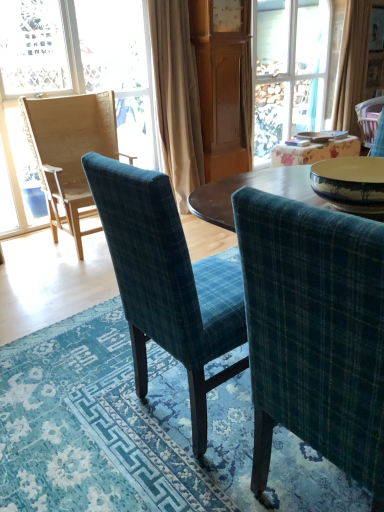
What do you see at coordinates (167, 282) in the screenshot? I see `teal plaid chair at center, the 2th chair positioned from the left` at bounding box center [167, 282].

In the scene shown: What is the approximate width of teal plaid chair at center, the third chair when ordered from right to left?

It is 22.24 inches.

What do you see at coordinates (69, 151) in the screenshot?
I see `woven wood chair at left, the first chair from the left` at bounding box center [69, 151].

What do you see at coordinates (314, 332) in the screenshot? The width and height of the screenshot is (384, 512). I see `teal plaid chair at center, marked as the third chair in a left-to-right arrangement` at bounding box center [314, 332].

Locate an element on the screen. The height and width of the screenshot is (512, 384). wooden table at center is located at coordinates (314, 151).

You are a GUI agent. You are given a task and a screenshot of the screen. Output one action in this format:
    pyautogui.click(x=<x>, y=<y>)
    Task: Click on the teal plaid chair at center, acting as the third chair starting from the back
    
    Given the screenshot: What is the action you would take?
    click(x=167, y=282)

Between pink fabric chair at upper right, the 1th chair from the back, and teal plaid chair at center, the third chair when ordered from right to left, which one has larger width?

teal plaid chair at center, the third chair when ordered from right to left, is wider.

Does pink fabric chair at upper right, which ranks as the 1th chair in right-to-left order, come behind teal plaid chair at center, the third chair when ordered from right to left?

Yes, pink fabric chair at upper right, which ranks as the 1th chair in right-to-left order, is further from the viewer.

Is point (357, 117) less distant than point (122, 264)?

No.

Is pink fabric chair at upper right, which ranks as the 1th chair in right-to-left order, facing away from teal plaid chair at center, which is counted as the second chair, starting from the front?

pink fabric chair at upper right, which ranks as the 1th chair in right-to-left order, does not have its back to teal plaid chair at center, which is counted as the second chair, starting from the front.

Can you confirm if blue textured rug at center is positioned to the right of wooden chair at left?

Indeed, blue textured rug at center is positioned on the right side of wooden chair at left.

Considering the points (130, 505) and (76, 85), which point is behind, point (130, 505) or point (76, 85)?

The point (76, 85) is more distant.

From their relative heights in the image, would you say blue textured rug at center is taller or shorter than wooden chair at left?

Considering their sizes, blue textured rug at center has less height than wooden chair at left.

Is blue textured rug at center bigger or smaller than wooden chair at left?

Clearly, blue textured rug at center is smaller in size than wooden chair at left.

From a real-world perspective, is wooden chair at left positioned over beige fabric curtain at center, the 1th curtain positioned from the left, based on gravity?

Yes, from a real-world perspective, wooden chair at left is over beige fabric curtain at center, the 1th curtain positioned from the left

Which of these two, wooden chair at left or beige fabric curtain at center, which is the 2th curtain in back-to-front order, is bigger?

wooden chair at left.

What's the angular difference between wooden chair at left and beige fabric curtain at center, which is the 2th curtain in back-to-front order,'s facing directions?

The facing directions of wooden chair at left and beige fabric curtain at center, which is the 2th curtain in back-to-front order, are 0.8 degrees apart.

Who is taller, wooden chair at left or beige fabric curtain at center, the 1th curtain positioned from the left?

wooden chair at left is taller.

Which of these two, pink fabric chair at upper right, the 1th chair from the back, or blue textured rug at center, is thinner?

pink fabric chair at upper right, the 1th chair from the back, is thinner.

Is pink fabric chair at upper right, arranged as the 4th chair when viewed from the left, aimed at blue textured rug at center?

No, pink fabric chair at upper right, arranged as the 4th chair when viewed from the left, is not turned towards blue textured rug at center.

Looking at this image, can you confirm if pink fabric chair at upper right, the fourth chair in the front-to-back sequence, is smaller than blue textured rug at center?

Yes.

Between pink fabric chair at upper right, which ranks as the 1th chair in right-to-left order, and blue textured rug at center, which one has less height?

Standing shorter between the two is blue textured rug at center.

Considering the relative sizes of gold textured curtain at upper right, which is counted as the second curtain, starting from the left, and woven wood chair at left, the first chair from the left, in the image provided, is gold textured curtain at upper right, which is counted as the second curtain, starting from the left, taller than woven wood chair at left, the first chair from the left,?

Correct, gold textured curtain at upper right, which is counted as the second curtain, starting from the left, is much taller as woven wood chair at left, the first chair from the left.

Which object is closer to the camera taking this photo, gold textured curtain at upper right, marked as the first curtain in a back-to-front arrangement, or woven wood chair at left, the first chair from the left?

woven wood chair at left, the first chair from the left, is closer to the camera.

From the picture: From the image's perspective, between gold textured curtain at upper right, marked as the first curtain in a back-to-front arrangement, and woven wood chair at left, the first chair from the left, which one is located above?

gold textured curtain at upper right, marked as the first curtain in a back-to-front arrangement, from the image's perspective.

Considering the sizes of objects gold textured curtain at upper right, positioned as the first curtain in right-to-left order, and woven wood chair at left, positioned as the 4th chair in right-to-left order, in the image provided, who is thinner, gold textured curtain at upper right, positioned as the first curtain in right-to-left order, or woven wood chair at left, positioned as the 4th chair in right-to-left order,?

gold textured curtain at upper right, positioned as the first curtain in right-to-left order.

Is beige fabric curtain at center, positioned as the 1th curtain in front-to-back order, situated inside teal plaid chair at center, marked as the third chair in a left-to-right arrangement, or outside?

beige fabric curtain at center, positioned as the 1th curtain in front-to-back order, exists outside the volume of teal plaid chair at center, marked as the third chair in a left-to-right arrangement.

Is the position of beige fabric curtain at center, positioned as the 1th curtain in front-to-back order, less distant than that of teal plaid chair at center, which appears as the first chair when viewed from the front?

No, it is behind teal plaid chair at center, which appears as the first chair when viewed from the front.

Who is smaller, beige fabric curtain at center, which is the 2th curtain in back-to-front order, or teal plaid chair at center, marked as the third chair in a left-to-right arrangement?

Smaller between the two is teal plaid chair at center, marked as the third chair in a left-to-right arrangement.

The width and height of the screenshot is (384, 512). What are the coordinates of `curtain below the gold textured curtain at upper right, the second curtain viewed from the front (from the image's perspective)` in the screenshot? It's located at (177, 97).

From a real-world perspective, which is physically below, gold textured curtain at upper right, which is counted as the second curtain, starting from the left, or beige fabric curtain at center, the second curtain viewed from the right?

beige fabric curtain at center, the second curtain viewed from the right, from a real-world perspective.

From the image's perspective, between gold textured curtain at upper right, which is counted as the second curtain, starting from the left, and beige fabric curtain at center, positioned as the 1th curtain in front-to-back order, who is located below?

beige fabric curtain at center, positioned as the 1th curtain in front-to-back order, is shown below in the image.

Is gold textured curtain at upper right, positioned as the first curtain in right-to-left order, aimed at beige fabric curtain at center, positioned as the 1th curtain in front-to-back order?

No, gold textured curtain at upper right, positioned as the first curtain in right-to-left order, is not oriented towards beige fabric curtain at center, positioned as the 1th curtain in front-to-back order.

Find the location of a particular element. The image size is (384, 512). the 2nd chair behind the teal plaid chair at center, the 2th chair positioned from the left is located at coordinates (369, 118).

Image resolution: width=384 pixels, height=512 pixels. Identify the location of window positioned vertically above the blue textured rug at center (from a real-world perspective). (77, 72).

Considering their positions, is wooden table at center positioned closer to transparent glass door at upper center than pink fabric chair at upper right, the 1th chair from the back?

Among the two, wooden table at center is located nearer to transparent glass door at upper center.

Which object lies nearer to the anchor point gold textured curtain at upper right, the second curtain viewed from the front, wooden table at center or pink fabric chair at upper right, the 1th chair from the back?

pink fabric chair at upper right, the 1th chair from the back, is closer to gold textured curtain at upper right, the second curtain viewed from the front.

Estimate the real-world distances between objects in this image. Which object is closer to teal plaid chair at center, acting as the third chair starting from the back, pink fabric chair at upper right, the 1th chair from the back, or wooden table at center?

wooden table at center.

Estimate the real-world distances between objects in this image. Which object is closer to transparent glass door at upper center, teal plaid chair at center, acting as the third chair starting from the back, or gold textured curtain at upper right, which is counted as the second curtain, starting from the left?

gold textured curtain at upper right, which is counted as the second curtain, starting from the left, is closer to transparent glass door at upper center.

Looking at the image, which one is located further to teal plaid chair at center, the third chair when ordered from right to left, wooden table at center or teal plaid chair at center, which is the 4th chair from back to front?

wooden table at center is further to teal plaid chair at center, the third chair when ordered from right to left.

Which object lies nearer to the anchor point pink fabric chair at upper right, the 1th chair from the back, wooden chair at left or blue textured rug at center?

Among the two, wooden chair at left is located nearer to pink fabric chair at upper right, the 1th chair from the back.

Looking at the image, which one is located further to wooden table at center, teal plaid chair at center, marked as the third chair in a left-to-right arrangement, or transparent glass door at upper center?

Among the two, teal plaid chair at center, marked as the third chair in a left-to-right arrangement, is located further to wooden table at center.

Looking at the image, which one is located closer to woven wood chair at left, arranged as the 3th chair when viewed from the front, beige fabric curtain at center, the second curtain viewed from the right, or blue textured rug at center?

beige fabric curtain at center, the second curtain viewed from the right, is closer to woven wood chair at left, arranged as the 3th chair when viewed from the front.

Locate an element on the screen. window located between teal plaid chair at center, acting as the third chair starting from the back, and beige fabric curtain at center, which is the 2th curtain in back-to-front order, in the depth direction is located at coordinates (77, 72).

Find the location of a particular element. The height and width of the screenshot is (512, 384). curtain between teal plaid chair at center, marked as the third chair in a left-to-right arrangement, and transparent glass door at upper center, along the z-axis is located at coordinates (177, 97).

Locate an element on the screen. The image size is (384, 512). mat positioned between teal plaid chair at center, marked as the third chair in a left-to-right arrangement, and gold textured curtain at upper right, positioned as the first curtain in right-to-left order, from near to far is located at coordinates (138, 433).

Image resolution: width=384 pixels, height=512 pixels. Identify the location of window between teal plaid chair at center, the 2th chair in the right-to-left sequence, and pink fabric chair at upper right, the 1th chair from the back, in the front-back direction. (77, 72).